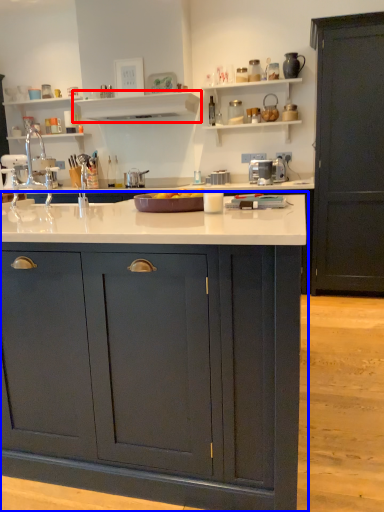
Question: Which object is further to the camera taking this photo, shelf (highlighted by a red box) or cabinetry (highlighted by a blue box)?

Choices:
 (A) shelf
 (B) cabinetry

Answer: (A)